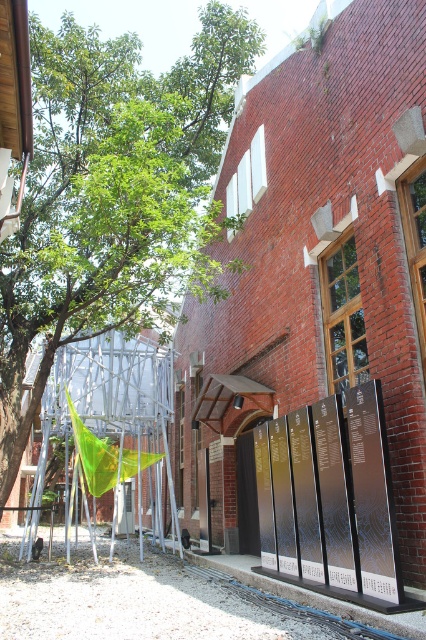
Does green leafy tree at upper left appear over metallic silver sign at center?

Correct, green leafy tree at upper left is located above metallic silver sign at center.

Is green leafy tree at upper left behind metallic silver sign at center?

Yes, green leafy tree at upper left is further from the viewer.

Describe the element at coordinates (112, 193) in the screenshot. The image size is (426, 640). I see `green leafy tree at upper left` at that location.

Where is `green leafy tree at upper left`? green leafy tree at upper left is located at coordinates (112, 193).

Does metallic silver sign at center lie behind metallic signboards at lower center?

Yes, metallic silver sign at center is further from the viewer.

Between metallic silver sign at center and metallic signboards at lower center, which one is positioned lower?

Positioned lower is metallic signboards at lower center.

This screenshot has width=426, height=640. What do you see at coordinates (331, 499) in the screenshot? I see `metallic silver sign at center` at bounding box center [331, 499].

Locate an element on the screen. The width and height of the screenshot is (426, 640). metallic silver sign at center is located at coordinates (331, 499).

Which of these two, green leafy tree at upper left or metallic signboards at lower center, stands taller?

Standing taller between the two is green leafy tree at upper left.

Between green leafy tree at upper left and metallic signboards at lower center, which one is positioned lower?

Positioned lower is metallic signboards at lower center.

Who is more forward, [40,164] or [147,588]?

Point [147,588]

At what (x,y) coordinates should I click in order to perform the action: click on green leafy tree at upper left. Please return your answer as a coordinate pair (x, y). Looking at the image, I should click on (112, 193).